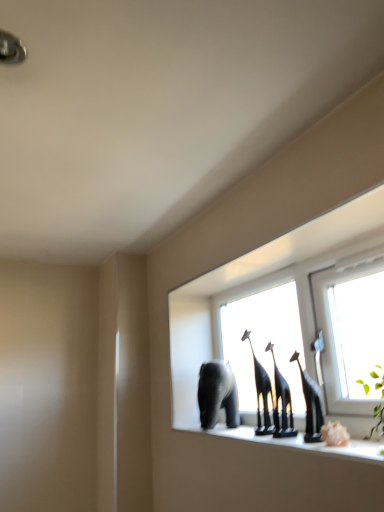
Question: Are gray matte elephant at center and black glossy giraffe at center making contact?

Choices:
 (A) no
 (B) yes

Answer: (A)

Question: Is gray matte elephant at center not close to black glossy giraffe at center?

Choices:
 (A) no
 (B) yes

Answer: (A)

Question: Is gray matte elephant at center taller than black glossy giraffe at center?

Choices:
 (A) yes
 (B) no

Answer: (B)

Question: Does gray matte elephant at center have a larger size compared to black glossy giraffe at center?

Choices:
 (A) no
 (B) yes

Answer: (B)

Question: Is gray matte elephant at center to the right of black glossy giraffe at center from the viewer's perspective?

Choices:
 (A) yes
 (B) no

Answer: (B)

Question: Is black glossy giraffe at center to the left or to the right of transparent glass window at center in the image?

Choices:
 (A) right
 (B) left

Answer: (B)

Question: Is black glossy giraffe at center in front of or behind transparent glass window at center in the image?

Choices:
 (A) front
 (B) behind

Answer: (B)

Question: Is point (279, 373) closer or farther from the camera than point (259, 359)?

Choices:
 (A) farther
 (B) closer

Answer: (B)

Question: In terms of width, does black glossy giraffe at center look wider or thinner when compared to transparent glass window at center?

Choices:
 (A) wide
 (B) thin

Answer: (B)

Question: From the image's perspective, is gray matte elephant at center located above or below transparent glass window at center?

Choices:
 (A) above
 (B) below

Answer: (B)

Question: Based on their positions, is gray matte elephant at center located to the left or right of transparent glass window at center?

Choices:
 (A) left
 (B) right

Answer: (A)

Question: In terms of size, does gray matte elephant at center appear bigger or smaller than transparent glass window at center?

Choices:
 (A) big
 (B) small

Answer: (B)

Question: Considering the positions of point (205, 415) and point (235, 263), is point (205, 415) closer or farther from the camera than point (235, 263)?

Choices:
 (A) closer
 (B) farther

Answer: (B)

Question: Considering the relative positions of transparent glass window at center and black glossy giraffe at center in the image provided, is transparent glass window at center to the left or to the right of black glossy giraffe at center?

Choices:
 (A) left
 (B) right

Answer: (B)

Question: Is transparent glass window at center inside the boundaries of black glossy giraffe at center, or outside?

Choices:
 (A) outside
 (B) inside

Answer: (A)